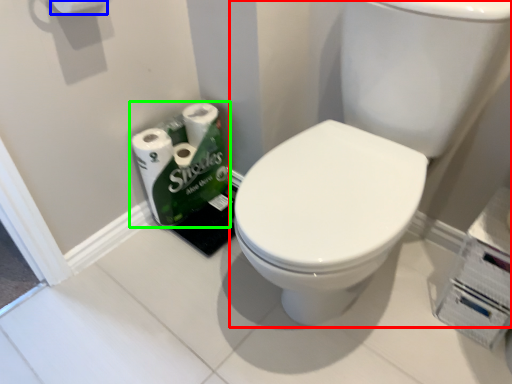
Question: Estimate the real-world distances between objects in this image. Which object is farther from sink (highlighted by a red box), toilet paper (highlighted by a blue box) or toilet paper (highlighted by a green box)?

Choices:
 (A) toilet paper
 (B) toilet paper

Answer: (A)